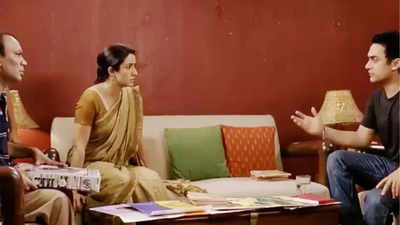
The image size is (400, 225). I want to click on table, so click(239, 208).